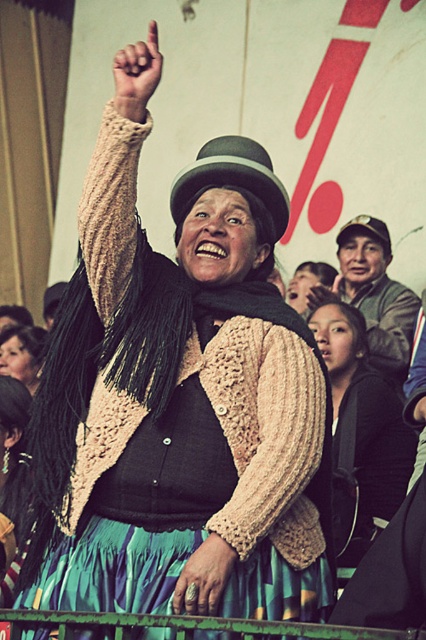
You are a jeweler who needs to create a replica of the silver metallic ring at center. You have a template based on the green felt hat at upper right. Will the ring replica be wider or narrower than the hat?

The silver metallic ring at center is narrower than the green felt hat at upper right, so the replica will also be narrower than the hat.

You are an observer watching the woman in the scene. You notice the matte black scarf at center and the matte black hand at upper center. Which object is positioned more to the right side of the scene?

The matte black scarf at center is positioned more to the right side of the scene compared to the matte black hand at upper center.